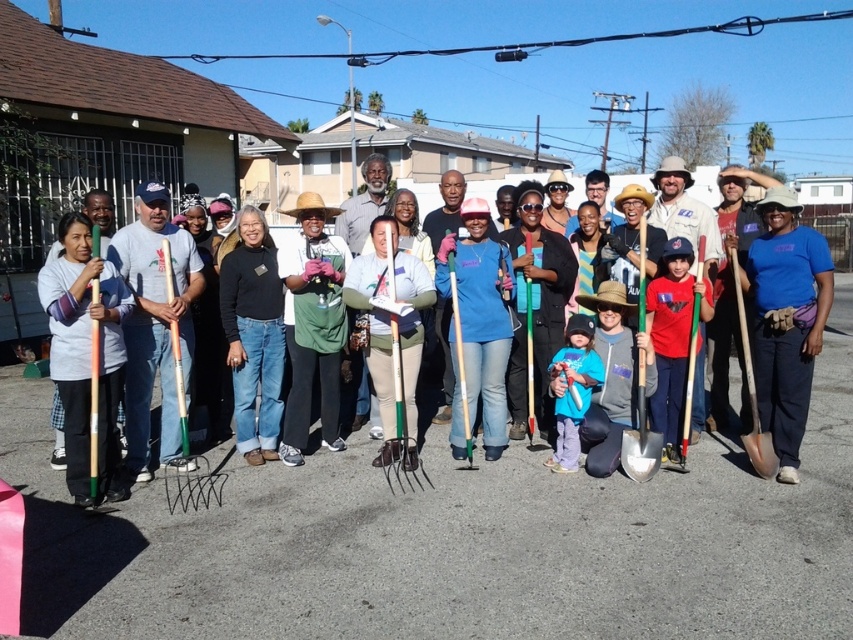
You are a gardener holding a 1.5 meter long hose. You need to water the plants between the matte green rake at center and the matte wood rake at left. Can you reach the entire area between them without moving the hose?

The distance between the matte green rake at center and the matte wood rake at left is 1.64 meters. Since the hose is 1.5 meters long, it is shorter than the distance between them. Therefore, you cannot reach the entire area between them without moving the hose.

You are a photographer standing in front of the group and want to take a picture that includes both the matte wood rake at left and the blue cotton shirt at center. Which object should you focus on first if you want to ensure both are in focus, considering their heights?

The matte wood rake at left is taller than the blue cotton shirt at center. To ensure both are in focus, focus on the matte wood rake at left since it is the taller object.

From the picture: Where is the matte green rake at center located in the image?

The matte green rake at center is located at the 2D coordinates point (x=694, y=228) in the image.